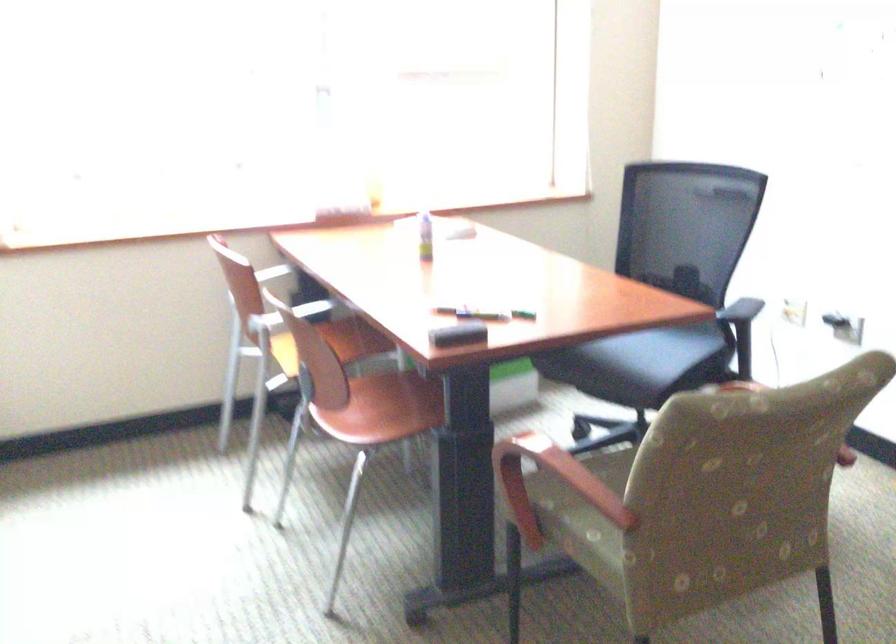
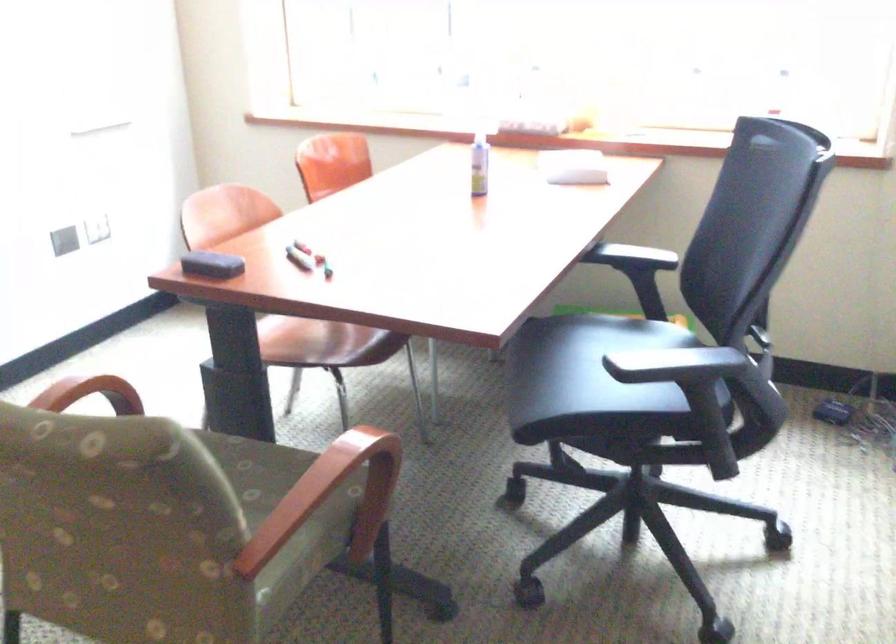
Locate, in the second image, the point that corresponds to the point at 474,315 in the first image.

(299, 258)